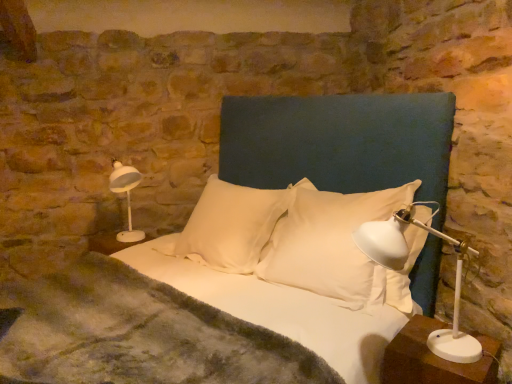
Question: From the image's perspective, would you say white glossy table lamp at left, which appears as the 1th table lamp when viewed from the left, is shown under white soft pillow at center, which is the 1th pillow from left to right?

Choices:
 (A) yes
 (B) no

Answer: (B)

Question: Considering the relative sizes of white glossy table lamp at left, which appears as the 1th table lamp when viewed from the back, and white soft pillow at center, positioned as the 2th pillow in right-to-left order, in the image provided, is white glossy table lamp at left, which appears as the 1th table lamp when viewed from the back, shorter than white soft pillow at center, positioned as the 2th pillow in right-to-left order,?

Choices:
 (A) no
 (B) yes

Answer: (B)

Question: Is white glossy table lamp at left, which appears as the 1th table lamp when viewed from the back, to the left of white soft pillow at center, positioned as the 2th pillow in right-to-left order, from the viewer's perspective?

Choices:
 (A) yes
 (B) no

Answer: (A)

Question: From the image's perspective, is white glossy table lamp at left, acting as the second table lamp starting from the front, on top of white soft pillow at center, which is the 1th pillow from left to right?

Choices:
 (A) yes
 (B) no

Answer: (A)

Question: Would you say white glossy table lamp at left, which appears as the second table lamp when viewed from the right, contains white soft pillow at center, positioned as the 2th pillow in right-to-left order?

Choices:
 (A) yes
 (B) no

Answer: (B)

Question: Is white glossy table lamp at left, which appears as the 1th table lamp when viewed from the left, turned away from white soft pillow at center, positioned as the 2th pillow in right-to-left order?

Choices:
 (A) yes
 (B) no

Answer: (B)

Question: Does white plastic table lamp at right, positioned as the second table lamp in left-to-right order, turn towards white fabric bed at center?

Choices:
 (A) yes
 (B) no

Answer: (A)

Question: Is white plastic table lamp at right, marked as the 1th table lamp in a front-to-back arrangement, in contact with white fabric bed at center?

Choices:
 (A) no
 (B) yes

Answer: (A)

Question: From a real-world perspective, is white plastic table lamp at right, arranged as the 2th table lamp when viewed from the back, positioned under white fabric bed at center based on gravity?

Choices:
 (A) yes
 (B) no

Answer: (B)

Question: Considering the relative positions of white plastic table lamp at right, arranged as the 2th table lamp when viewed from the back, and white fabric bed at center in the image provided, is white plastic table lamp at right, arranged as the 2th table lamp when viewed from the back, behind white fabric bed at center?

Choices:
 (A) yes
 (B) no

Answer: (A)

Question: Can you confirm if white plastic table lamp at right, arranged as the 1th table lamp when viewed from the right, is taller than white fabric bed at center?

Choices:
 (A) no
 (B) yes

Answer: (A)

Question: Is there a large distance between white plastic table lamp at right, positioned as the second table lamp in left-to-right order, and white fabric bed at center?

Choices:
 (A) yes
 (B) no

Answer: (B)

Question: From the image's perspective, is white plastic nightstand at lower right below white plastic table lamp at right, arranged as the 2th table lamp when viewed from the back?

Choices:
 (A) yes
 (B) no

Answer: (A)